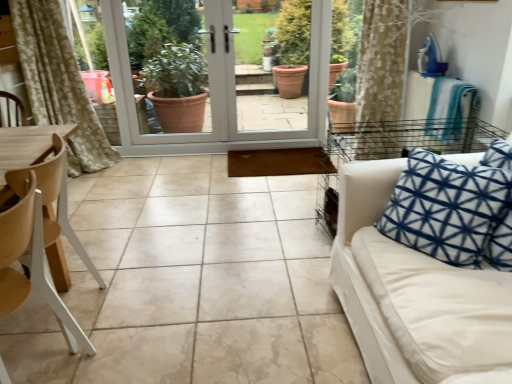
Question: Is wooden at left, the 2th chair in the front-to-back sequence, not within white glossy screen door at center?

Choices:
 (A) no
 (B) yes

Answer: (B)

Question: Considering the relative sizes of wooden at left, placed as the 1th chair when sorted from back to front, and white glossy screen door at center in the image provided, is wooden at left, placed as the 1th chair when sorted from back to front, thinner than white glossy screen door at center?

Choices:
 (A) yes
 (B) no

Answer: (B)

Question: Does wooden at left, placed as the 1th chair when sorted from back to front, lie behind white glossy screen door at center?

Choices:
 (A) yes
 (B) no

Answer: (B)

Question: Is wooden at left, the 2th chair in the front-to-back sequence, taller than white glossy screen door at center?

Choices:
 (A) yes
 (B) no

Answer: (B)

Question: From the image's perspective, is white wood chair at left, the 2th chair from the back, positioned above or below wooden at left, the 2th chair in the front-to-back sequence?

Choices:
 (A) above
 (B) below

Answer: (B)

Question: In terms of width, does white wood chair at left, the 1th chair positioned from the front, look wider or thinner when compared to wooden at left, the 2th chair in the front-to-back sequence?

Choices:
 (A) thin
 (B) wide

Answer: (A)

Question: In the image, is white wood chair at left, the 2th chair from the back, on the left side or the right side of wooden at left, the 2th chair in the front-to-back sequence?

Choices:
 (A) left
 (B) right

Answer: (B)

Question: Is white wood chair at left, the 2th chair from the back, spatially inside wooden at left, the 2th chair in the front-to-back sequence, or outside of it?

Choices:
 (A) outside
 (B) inside

Answer: (A)

Question: Relative to white fabric couch at right, is white glossy screen door at center in front or behind?

Choices:
 (A) behind
 (B) front

Answer: (A)

Question: Is white glossy screen door at center to the left or to the right of white fabric couch at right in the image?

Choices:
 (A) left
 (B) right

Answer: (A)

Question: In terms of size, does white glossy screen door at center appear bigger or smaller than white fabric couch at right?

Choices:
 (A) big
 (B) small

Answer: (B)

Question: Does point (207, 19) appear closer or farther from the camera than point (379, 345)?

Choices:
 (A) farther
 (B) closer

Answer: (A)

Question: Considering the positions of white fabric couch at right and white glossy screen door at center in the image, is white fabric couch at right taller or shorter than white glossy screen door at center?

Choices:
 (A) tall
 (B) short

Answer: (B)

Question: In the image, is white fabric couch at right positioned in front of or behind white glossy screen door at center?

Choices:
 (A) behind
 (B) front

Answer: (B)